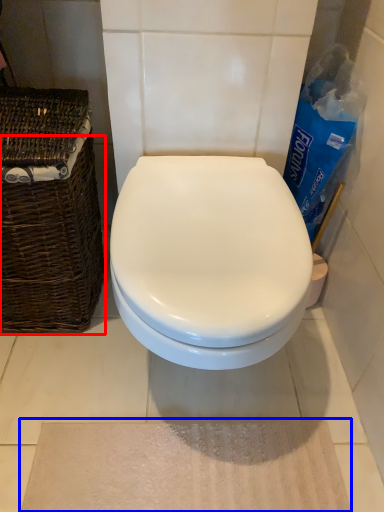
Question: Which of the following is the farthest to the observer, basket (highlighted by a red box) or bath mat (highlighted by a blue box)?

Choices:
 (A) basket
 (B) bath mat

Answer: (B)